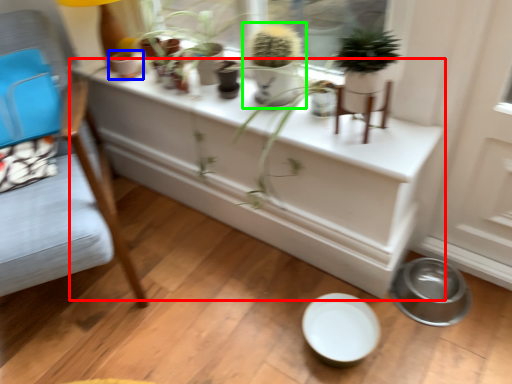
Question: Considering the real-world distances, which object is farthest from table (highlighted by a red box)? flowerpot (highlighted by a blue box) or houseplant (highlighted by a green box)?

Choices:
 (A) flowerpot
 (B) houseplant

Answer: (A)